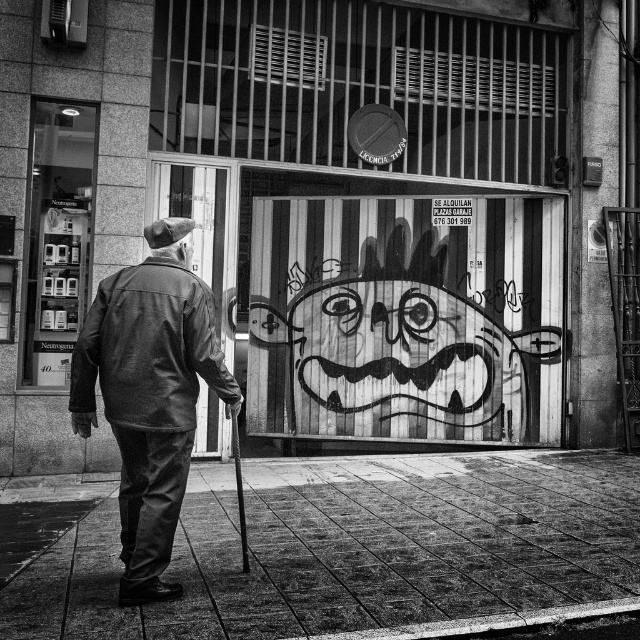
Question: Does smooth concrete pavement at center appear over leather jacket at center?

Choices:
 (A) no
 (B) yes

Answer: (A)

Question: Among these points, which one is farthest from the camera?

Choices:
 (A) (220, 560)
 (B) (150, 339)

Answer: (A)

Question: Does smooth concrete pavement at center appear on the left side of leather jacket at center?

Choices:
 (A) no
 (B) yes

Answer: (B)

Question: Does smooth concrete pavement at center have a larger size compared to leather jacket at center?

Choices:
 (A) yes
 (B) no

Answer: (B)

Question: Which of the following is the farthest from the observer?

Choices:
 (A) (176, 397)
 (B) (292, 557)

Answer: (B)